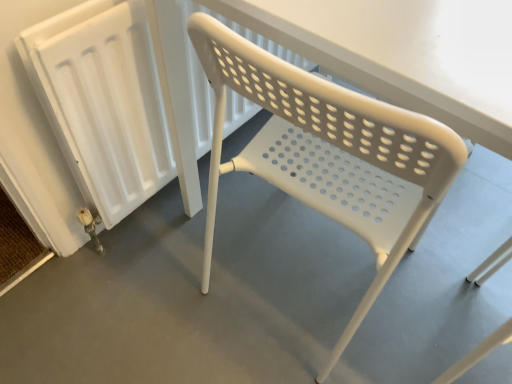
Measure the distance between white plastic chair at center and camera.

white plastic chair at center and camera are 37.66 inches apart.

Measure the distance between point (x=448, y=180) and camera.

Point (x=448, y=180) and camera are 18.31 inches apart.

This screenshot has width=512, height=384. Find the location of `white plastic chair at center`. white plastic chair at center is located at coordinates (191, 296).

Does point (405, 274) appear closer or farther from the camera than point (378, 145)?

Point (405, 274) appears to be farther away from the viewer than point (378, 145).

Considering the relative positions of white plastic chair at center and white plastic chair at center in the image provided, is white plastic chair at center to the left or to the right of white plastic chair at center?

In the image, white plastic chair at center appears on the right side of white plastic chair at center.

Considering the sizes of white plastic chair at center and white plastic chair at center in the image, is white plastic chair at center taller or shorter than white plastic chair at center?

white plastic chair at center is shorter than white plastic chair at center.

Is the position of white plastic chair at center less distant than that of white plastic radiator at left?

Yes, the depth of white plastic chair at center is less than that of white plastic radiator at left.

Is white plastic chair at center looking in the opposite direction of white plastic radiator at left?

No, white plastic chair at center is not facing away from white plastic radiator at left.

Looking at this image, which of these two, white plastic chair at center or white plastic radiator at left, is bigger?

Bigger between the two is white plastic chair at center.

Which is farther, (250, 228) or (106, 220)?

The point (250, 228) is farther from the camera.

Is white plastic chair at center taller than white plastic chair at center?

Yes.

Between white plastic chair at center and white plastic chair at center, which one has smaller width?

Thinner between the two is white plastic chair at center.

Measure the distance between white plastic chair at center and white plastic chair at center.

white plastic chair at center and white plastic chair at center are 40.53 centimeters apart.

From a real-world perspective, is white plastic radiator at left over white plastic chair at center?

Yes, from a real-world perspective, white plastic radiator at left is over white plastic chair at center

From the image's perspective, is white plastic radiator at left below white plastic chair at center?

No.

Is white plastic radiator at left positioned with its back to white plastic chair at center?

No, white plastic radiator at left is not facing away from white plastic chair at center.

How distant is white plastic chair at center from white plastic radiator at left?

The distance of white plastic chair at center from white plastic radiator at left is 13.01 inches.

Can you confirm if white plastic chair at center is smaller than white plastic radiator at left?

Incorrect, white plastic chair at center is not smaller in size than white plastic radiator at left.

Which object is closer to the camera, white plastic chair at center or white plastic radiator at left?

Positioned in front is white plastic chair at center.

Who is shorter, white plastic chair at center or white plastic radiator at left?

Standing shorter between the two is white plastic radiator at left.

How much distance is there between white plastic radiator at left and white plastic chair at center?

13.01 inches.

Which of these two, white plastic radiator at left or white plastic chair at center, is smaller?

white plastic radiator at left.

Does white plastic radiator at left touch white plastic chair at center?

white plastic radiator at left is not next to white plastic chair at center, and they're not touching.

Considering the sizes of objects white plastic radiator at left and white plastic chair at center in the image provided, who is wider, white plastic radiator at left or white plastic chair at center?

white plastic chair at center is wider.

Where is `concrete below the white plastic chair at center (from the image's perspective)`? Image resolution: width=512 pixels, height=384 pixels. concrete below the white plastic chair at center (from the image's perspective) is located at coordinates pyautogui.click(x=191, y=296).

Where is `radiator that appears behind the white plastic chair at center`? This screenshot has width=512, height=384. radiator that appears behind the white plastic chair at center is located at coordinates (103, 101).

Looking at the image, which one is located closer to white plastic chair at center, white plastic radiator at left or white plastic chair at center?

white plastic radiator at left lies closer to white plastic chair at center than the other object.

Based on the photo, which object lies further to the anchor point white plastic radiator at left, white plastic chair at center or white plastic chair at center?

Based on the image, white plastic chair at center appears to be further to white plastic radiator at left.

Considering their positions, is white plastic chair at center positioned further to white plastic chair at center than white plastic radiator at left?

Based on the image, white plastic radiator at left appears to be further to white plastic chair at center.

Considering their positions, is white plastic radiator at left positioned closer to white plastic chair at center than white plastic chair at center?

The object closer to white plastic chair at center is white plastic chair at center.

Based on their spatial positions, is white plastic chair at center or white plastic radiator at left further from white plastic chair at center?

Among the two, white plastic chair at center is located further to white plastic chair at center.

Which object lies further to the anchor point white plastic radiator at left, white plastic chair at center or white plastic chair at center?

white plastic chair at center.

Find the location of a particular element. This screenshot has height=384, width=512. chair between white plastic radiator at left and white plastic chair at center from left to right is located at coordinates (329, 153).